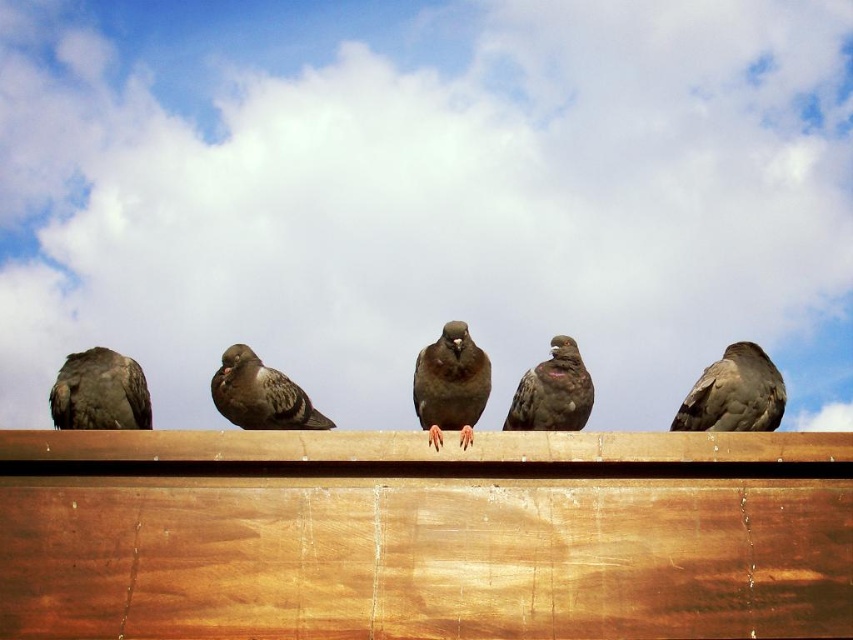
Does brown feathered pigeon at center have a lesser height compared to brown matte pigeon at center?

Yes, brown feathered pigeon at center is shorter than brown matte pigeon at center.

Is point (717, 396) farther from viewer compared to point (445, 358)?

Yes.

Locate an element on the screen. This screenshot has height=640, width=853. brown feathered pigeon at center is located at coordinates (734, 394).

Does brown matte pigeon at center have a larger size compared to brown feathered pigeon at left?

Correct, brown matte pigeon at center is larger in size than brown feathered pigeon at left.

Which is in front, point (436, 388) or point (119, 413)?

Positioned in front is point (436, 388).

Locate an element on the screen. brown matte pigeon at center is located at coordinates (450, 385).

Is brown matte pigeon at center to the left of gray matte pigeon at center from the viewer's perspective?

In fact, brown matte pigeon at center is to the right of gray matte pigeon at center.

Which is behind, point (434, 342) or point (231, 356)?

Positioned behind is point (231, 356).

Between point (433, 428) and point (241, 374), which one is positioned in front?

Point (433, 428) is in front.

Identify the location of brown matte pigeon at center. (450, 385).